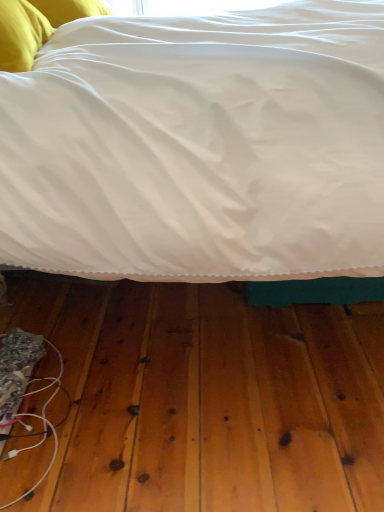
What do you see at coordinates (69, 9) in the screenshot? The image size is (384, 512). I see `yellow fabric pillow at upper left` at bounding box center [69, 9].

The height and width of the screenshot is (512, 384). I want to click on yellow fabric pillow at upper left, so click(x=69, y=9).

Choose the correct answer: Is white fabric wire at lower left inside yellow fabric pillow at upper left or outside it?

white fabric wire at lower left is outside yellow fabric pillow at upper left.

Does white fabric wire at lower left turn towards yellow fabric pillow at upper left?

No, white fabric wire at lower left is not turned towards yellow fabric pillow at upper left.

Can you tell me how much white fabric wire at lower left and yellow fabric pillow at upper left differ in facing direction?

There is a 27.4-degree angle between the facing directions of white fabric wire at lower left and yellow fabric pillow at upper left.

From the image's perspective, between white fabric wire at lower left and yellow fabric pillow at upper left, who is located below?

white fabric wire at lower left is shown below in the image.

Is yellow fabric pillow at upper left directly adjacent to white fabric wire at lower left?

No.

In the scene shown: Which is closer, (78, 8) or (52, 460)?

Point (52, 460)

From the picture: From a real-world perspective, which object rests below the other?

white fabric wire at lower left is physically lower.

Is yellow fabric pillow at upper left shorter than white fabric wire at lower left?

Correct, yellow fabric pillow at upper left is not as tall as white fabric wire at lower left.

Is white satin bed at center positioned before yellow fabric pillow at upper left?

Yes.

Find the location of `bed in front of the yellow fabric pillow at upper left`. bed in front of the yellow fabric pillow at upper left is located at coordinates (200, 147).

From a real-world perspective, between white satin bed at center and yellow fabric pillow at upper left, who is vertically higher?

yellow fabric pillow at upper left, from a real-world perspective.

Looking at this image, which object is more forward, yellow fabric pillow at upper left or white satin bed at center?

white satin bed at center.

Is yellow fabric pillow at upper left next to white satin bed at center?

No, yellow fabric pillow at upper left is not with white satin bed at center.

Between yellow fabric pillow at upper left and white satin bed at center, which one has more height?

white satin bed at center.

Considering the positions of objects yellow fabric pillow at upper left and white satin bed at center in the image provided, who is more to the left, yellow fabric pillow at upper left or white satin bed at center?

yellow fabric pillow at upper left is more to the left.

From the image's perspective, which is above, white satin bed at center or white fabric wire at lower left?

white satin bed at center is shown above in the image.

From the picture: Measure the distance from white satin bed at center to white fabric wire at lower left.

They are 24.86 inches apart.

Can you confirm if white satin bed at center is thinner than white fabric wire at lower left?

Incorrect, the width of white satin bed at center is not less than that of white fabric wire at lower left.

From a real-world perspective, is white fabric wire at lower left under white satin bed at center?

Yes.

How distant is white fabric wire at lower left from white satin bed at center?

white fabric wire at lower left is 24.86 inches away from white satin bed at center.

Could you tell me if white fabric wire at lower left is turned towards white satin bed at center?

Yes, white fabric wire at lower left faces towards white satin bed at center.

Consider the image. Considering the sizes of objects white fabric wire at lower left and white satin bed at center in the image provided, who is thinner, white fabric wire at lower left or white satin bed at center?

white fabric wire at lower left.

The width and height of the screenshot is (384, 512). What are the coordinates of `pillow located behind the white fabric wire at lower left` in the screenshot? It's located at (69, 9).

I want to click on wire on the right of yellow fabric pillow at upper left, so click(x=43, y=425).

Based on the photo, estimate the real-world distances between objects in this image. Which object is further from white satin bed at center, white fabric wire at lower left or yellow fabric pillow at upper left?

Among the two, yellow fabric pillow at upper left is located further to white satin bed at center.

Estimate the real-world distances between objects in this image. Which object is closer to yellow fabric pillow at upper left, white fabric wire at lower left or white satin bed at center?

Based on the image, white satin bed at center appears to be nearer to yellow fabric pillow at upper left.

When comparing their distances from yellow fabric pillow at upper left, does white satin bed at center or white fabric wire at lower left seem closer?

The object closer to yellow fabric pillow at upper left is white satin bed at center.

From the image, which object appears to be nearer to white fabric wire at lower left, yellow fabric pillow at upper left or white satin bed at center?

Among the two, white satin bed at center is located nearer to white fabric wire at lower left.

From the picture: Estimate the real-world distances between objects in this image. Which object is further from white fabric wire at lower left, white satin bed at center or yellow fabric pillow at upper left?

Among the two, yellow fabric pillow at upper left is located further to white fabric wire at lower left.

Based on their spatial positions, is yellow fabric pillow at upper left or white fabric wire at lower left closer to white satin bed at center?

A: The object closer to white satin bed at center is white fabric wire at lower left.

You are a GUI agent. You are given a task and a screenshot of the screen. Output one action in this format:
    pyautogui.click(x=<x>, y=<y>)
    Task: Click on the bed between yellow fabric pillow at upper left and white fabric wire at lower left vertically
    
    Given the screenshot: What is the action you would take?
    pyautogui.click(x=200, y=147)